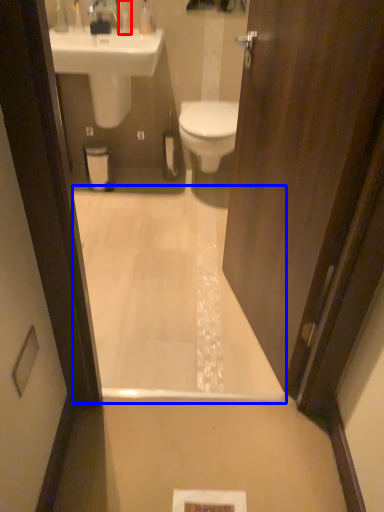
Question: Which point is further to the camera, toiletry (highlighted by a red box) or bath (highlighted by a blue box)?

Choices:
 (A) toiletry
 (B) bath

Answer: (A)